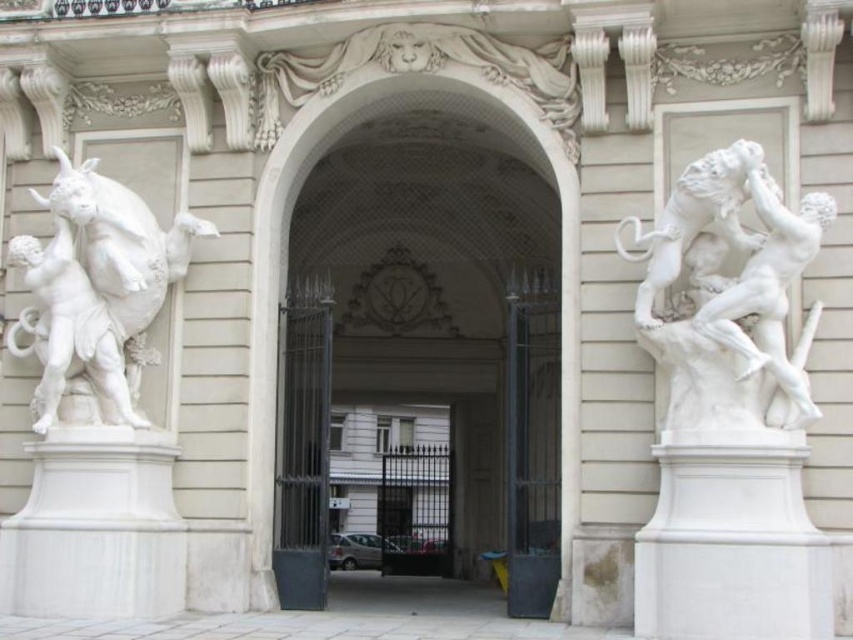
Is white marble sculpture at right positioned before white marble archway at center?

Yes, it is in front of white marble archway at center.

How far apart are white marble sculpture at right and white marble archway at center?

white marble sculpture at right is 27.27 feet away from white marble archway at center.

Where is `white marble sculpture at right`? This screenshot has width=853, height=640. white marble sculpture at right is located at coordinates (733, 288).

Identify the location of white marble sculpture at right. (733, 288).

Does white marble sculpture at right come in front of white marble statue at left?

That is True.

Does white marble sculpture at right have a greater height compared to white marble statue at left?

No.

I want to click on white marble sculpture at right, so click(733, 288).

This screenshot has height=640, width=853. What do you see at coordinates (285, 256) in the screenshot?
I see `white marble archway at center` at bounding box center [285, 256].

Between white marble archway at center and white marble statue at left, which one appears on the right side from the viewer's perspective?

white marble archway at center

Does point (517, 90) lie in front of point (33, 337)?

That is True.

You are a GUI agent. You are given a task and a screenshot of the screen. Output one action in this format:
    pyautogui.click(x=<x>, y=<y>)
    Task: Click on the white marble archway at center
    
    Given the screenshot: What is the action you would take?
    pyautogui.click(x=285, y=256)